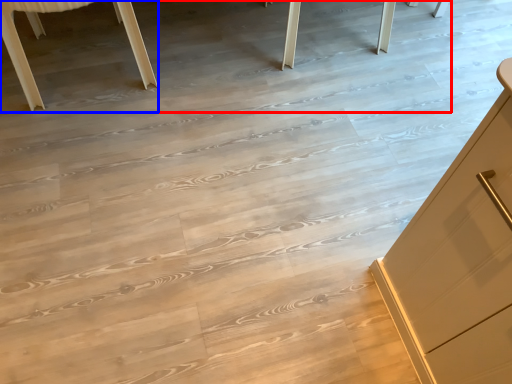
Question: Which object is further to the camera taking this photo, table (highlighted by a red box) or furniture (highlighted by a blue box)?

Choices:
 (A) table
 (B) furniture

Answer: (A)